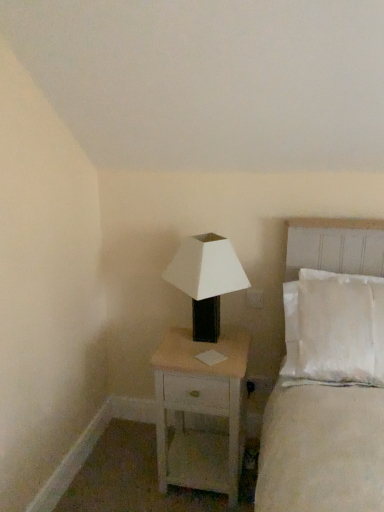
Locate an element on the screen. The image size is (384, 512). empty space that is ontop of white wood nightstand at center (from a real-world perspective) is located at coordinates (205, 350).